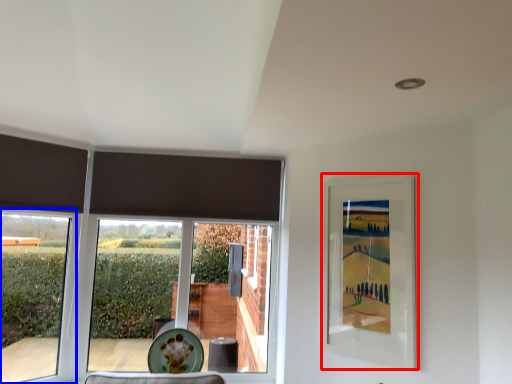
Question: Which of the following is the farthest to the observer, picture frame (highlighted by a red box) or window (highlighted by a blue box)?

Choices:
 (A) picture frame
 (B) window

Answer: (B)